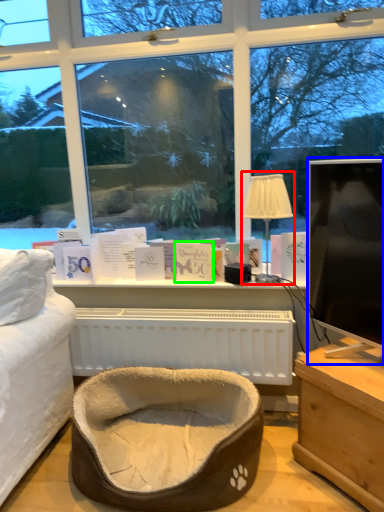
Question: Considering the real-world distances, which object is closest to table lamp (highlighted by a red box)? television (highlighted by a blue box) or book (highlighted by a green box).

Choices:
 (A) television
 (B) book

Answer: (A)